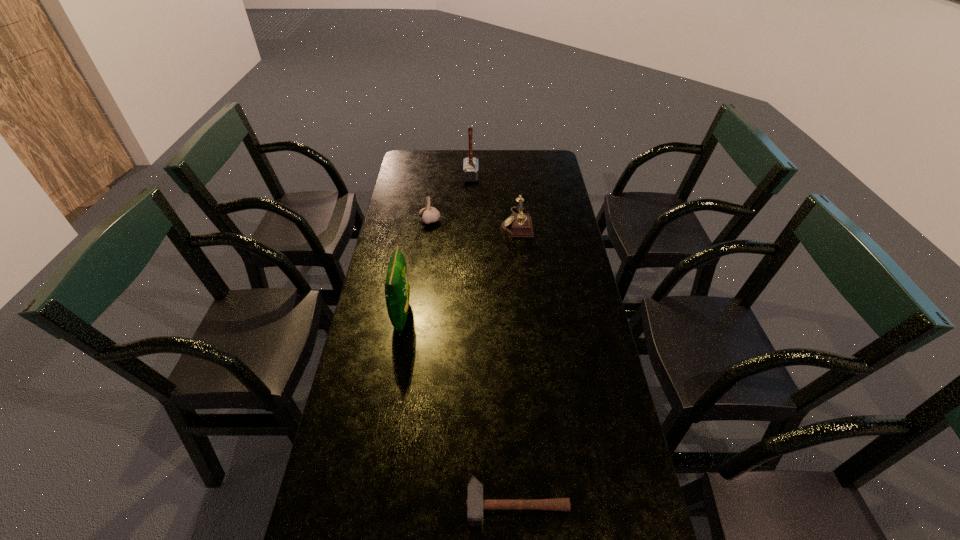
Locate an element on the screen. This screenshot has width=960, height=540. vacant point located between the telephone and the taller hammer is located at coordinates (493, 200).

Identify the location of vacant area that lies between the telephone and the farther hammer. (493, 200).

You are a GUI agent. You are given a task and a screenshot of the screen. Output one action in this format:
    pyautogui.click(x=<x>, y=<y>)
    Task: Click on the object that is the fourth closest to the second nearest object
    The image size is (960, 540).
    Given the screenshot: What is the action you would take?
    pyautogui.click(x=470, y=165)

Identify the location of the second closest object to the shortest object. The image size is (960, 540). (519, 224).

Locate an element on the screen. vacant space that satisfies the following two spatial constraints: 1. on the front side of the garlic; 2. on the front-facing side of the fourth farthest object is located at coordinates point(417,316).